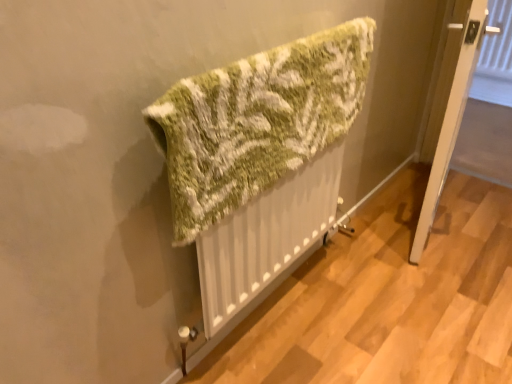
Question: In the image, is green knitted towel at center on the left side or the right side of white wooden door at lower right?

Choices:
 (A) left
 (B) right

Answer: (A)

Question: From a real-world perspective, is green knitted towel at center physically located above or below white wooden door at lower right?

Choices:
 (A) below
 (B) above

Answer: (B)

Question: Is green knitted towel at center inside the boundaries of white wooden door at lower right, or outside?

Choices:
 (A) inside
 (B) outside

Answer: (B)

Question: Is white wooden door at lower right to the left or to the right of green knitted towel at center in the image?

Choices:
 (A) right
 (B) left

Answer: (A)

Question: From the image's perspective, is white wooden door at lower right positioned above or below green knitted towel at center?

Choices:
 (A) below
 (B) above

Answer: (B)

Question: Is point (430, 190) closer or farther from the camera than point (285, 142)?

Choices:
 (A) closer
 (B) farther

Answer: (B)

Question: From a real-world perspective, is white wooden door at lower right positioned above or below green knitted towel at center?

Choices:
 (A) above
 (B) below

Answer: (B)